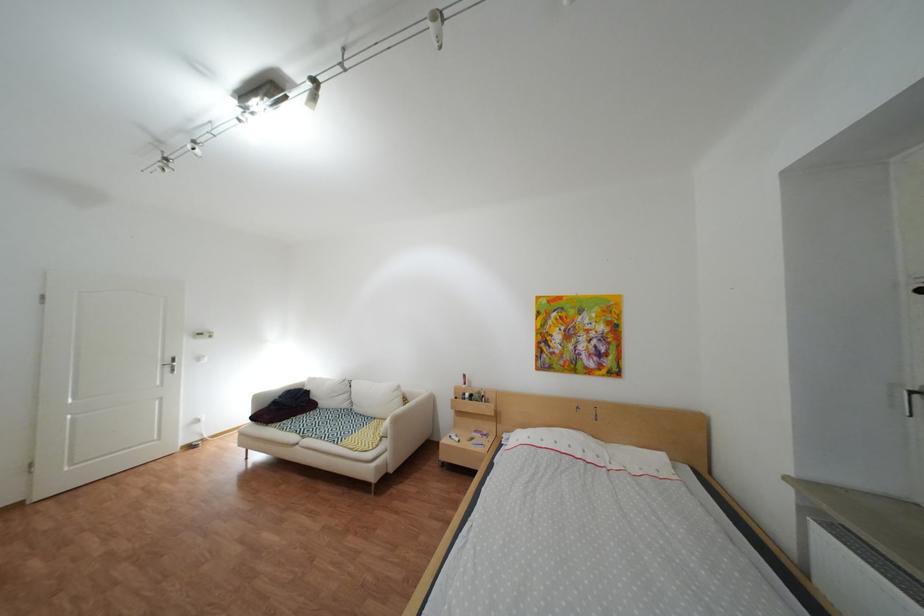
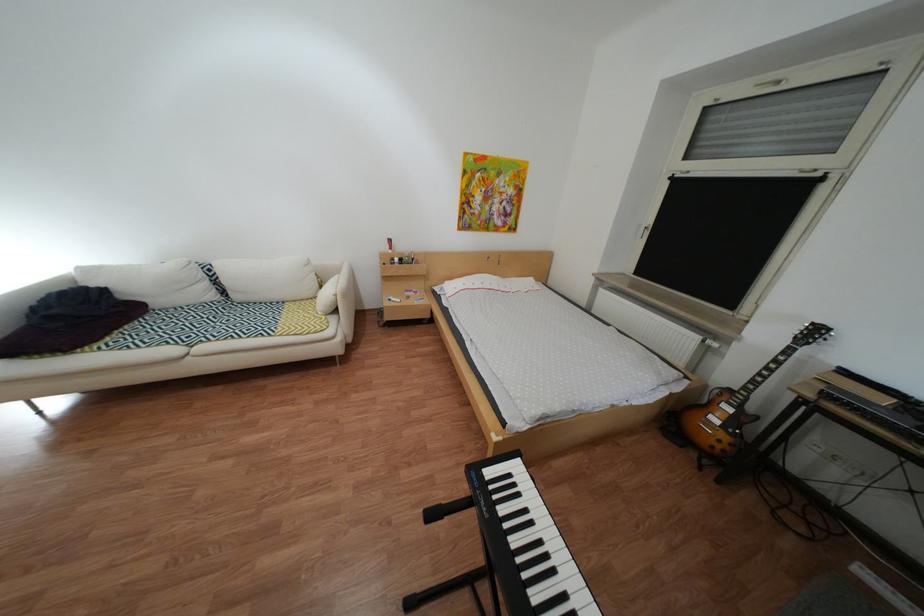
In the second image, find the point that corresponds to (x=337, y=405) in the first image.

(172, 304)